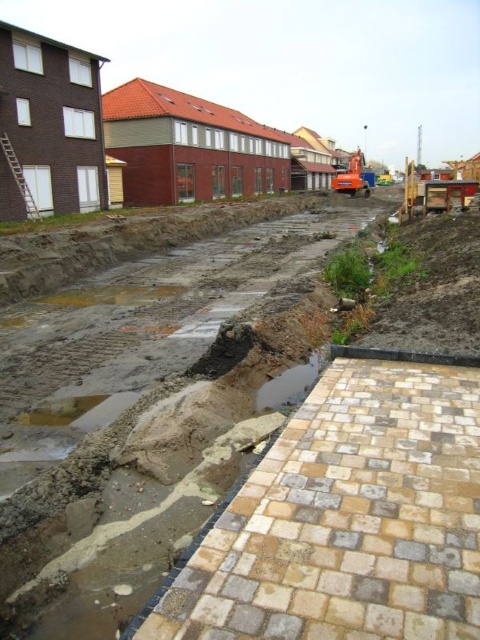
You are a construction worker carrying heavy tools and need to cross from the natural stone paving at lower right to the shiny concrete puddle at lower center. Which surface should you avoid stepping on to prevent slipping?

You should avoid stepping on the shiny concrete puddle at lower center because it is a puddle of water, which is slippery, while the natural stone paving at lower right provides a more stable footing.

You are a construction worker needing to place a 3ft wide equipment on the ground. You see the natural stone paving at lower right and the shiny concrete puddle at lower center. Which surface can safely accommodate the equipment without it sinking into the ground?

The natural stone paving at lower right has a larger width than the shiny concrete puddle at lower center, so it can safely accommodate the 3ft wide equipment.